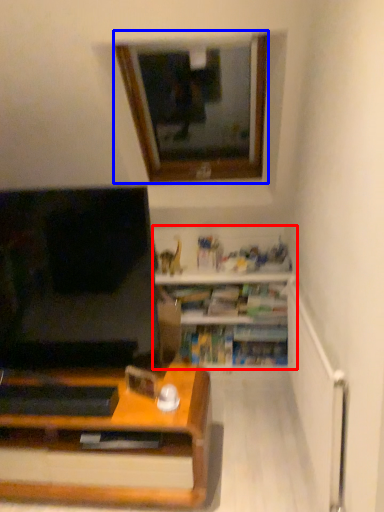
Question: Which of the following is the farthest to the observer, shelf (highlighted by a red box) or window (highlighted by a blue box)?

Choices:
 (A) shelf
 (B) window

Answer: (A)